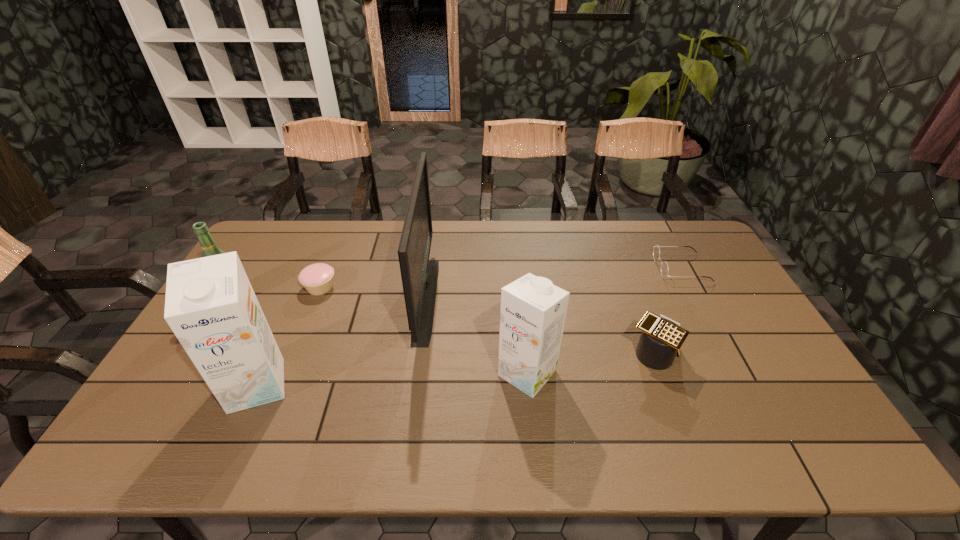
Observe the arrangement of all cartons in the image. To keep them evenly spaced, where would you place another carton on the right? Please locate a free space. Please provide its 2D coordinates. Your answer should be formatted as a tuple, i.e. [(x, y)], where the tuple contains the x and y coordinates of a point satisfying the conditions above.

[(784, 361)]